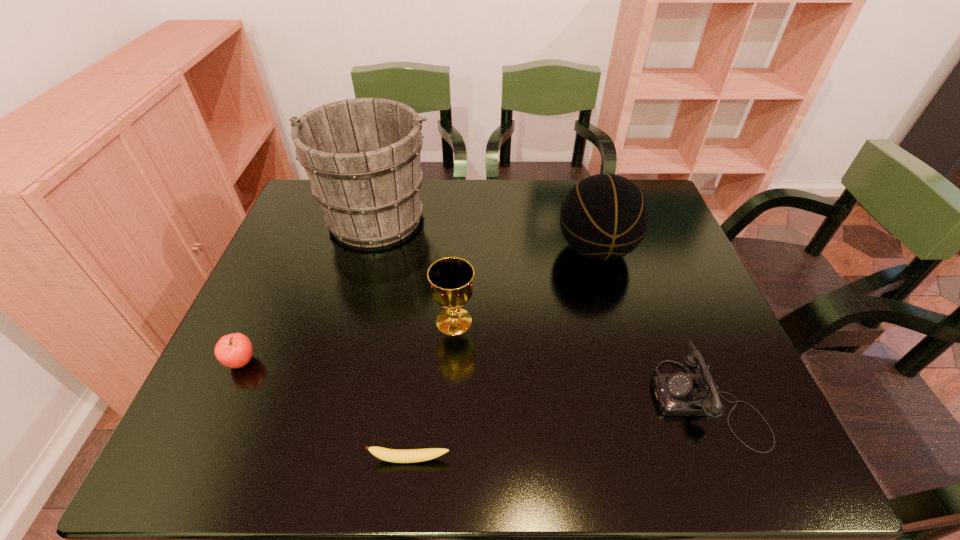
Find the location of a particular element. The image size is (960, 540). bucket is located at coordinates (362, 156).

Where is `basketball`? The image size is (960, 540). basketball is located at coordinates (604, 217).

The image size is (960, 540). I want to click on chalice, so click(x=451, y=278).

At what (x,y) coordinates should I click in order to perform the action: click on the fourth nearest object. Please return your answer as a coordinate pair (x, y). Image resolution: width=960 pixels, height=540 pixels. Looking at the image, I should click on (451, 278).

Image resolution: width=960 pixels, height=540 pixels. I want to click on the leftmost object, so click(234, 350).

Locate an element on the screen. The width and height of the screenshot is (960, 540). telephone is located at coordinates (677, 394).

Locate an element on the screen. This screenshot has width=960, height=540. the shortest object is located at coordinates (391, 455).

This screenshot has height=540, width=960. I want to click on free location located on the back of the basketball, so click(584, 207).

This screenshot has width=960, height=540. What are the coordinates of `free space located on the back of the fourth nearest object` in the screenshot? It's located at (457, 271).

Identify the location of free space located on the right of the apple. (321, 362).